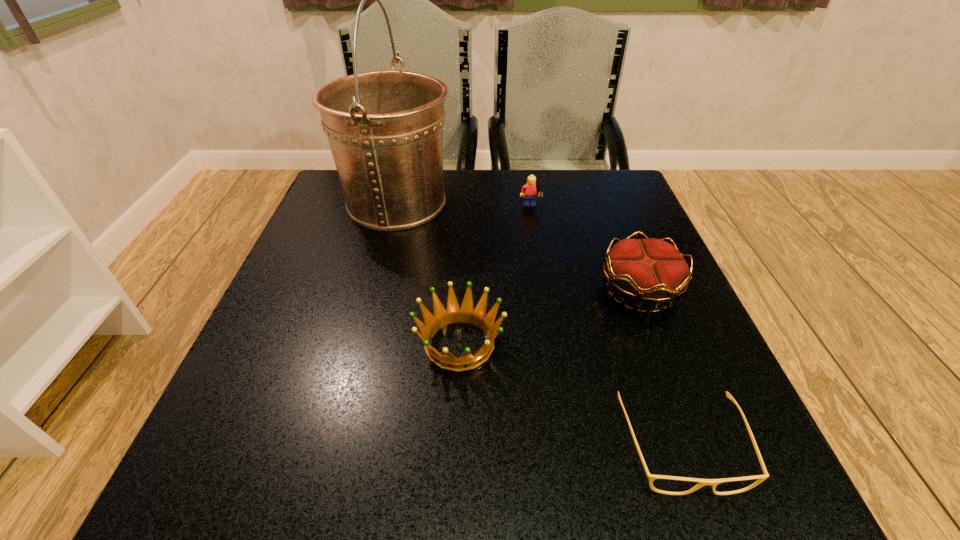
Where is `vacant space located 0.060m on the front of the left crown`? The image size is (960, 540). vacant space located 0.060m on the front of the left crown is located at coordinates (456, 417).

The width and height of the screenshot is (960, 540). I want to click on bucket at the far edge, so click(385, 128).

Locate an element on the screen. Lego present at the far edge is located at coordinates (529, 191).

The width and height of the screenshot is (960, 540). What are the coordinates of `object that is at the near edge` in the screenshot? It's located at (702, 482).

The height and width of the screenshot is (540, 960). Find the location of `object that is at the left edge`. object that is at the left edge is located at coordinates (385, 128).

Locate an element on the screen. crown positioned at the right edge is located at coordinates (650, 271).

Find the location of `spectacles that is at the right edge`. spectacles that is at the right edge is located at coordinates (702, 482).

Where is `object that is at the far left corner`? This screenshot has width=960, height=540. object that is at the far left corner is located at coordinates (385, 128).

Where is `object that is at the near right corner`? The height and width of the screenshot is (540, 960). object that is at the near right corner is located at coordinates (702, 482).

In order to click on vacant region at the far edge in this screenshot , I will do point(521,211).